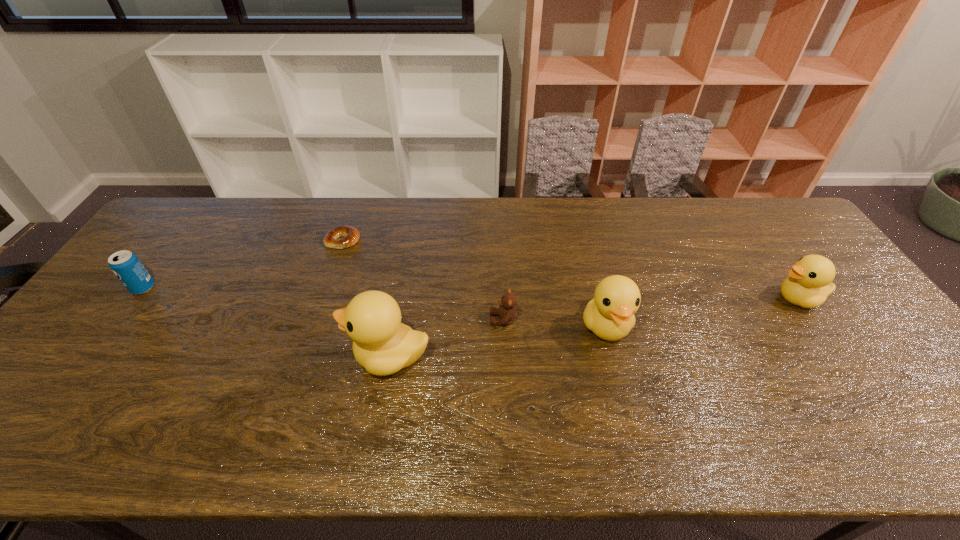
Locate an element on the screen. The image size is (960, 540). teddy bear is located at coordinates (507, 312).

Locate an element on the screen. free point located 0.370m on the face of the third object from left to right is located at coordinates (201, 356).

I want to click on free space located 0.390m on the face of the third object from left to right, so click(x=193, y=356).

The height and width of the screenshot is (540, 960). In order to click on vacant space situated on the face of the third object from left to right in this screenshot , I will do `click(217, 356)`.

This screenshot has height=540, width=960. Find the location of `blank space located 0.090m on the face of the fifth object from left to right`. blank space located 0.090m on the face of the fifth object from left to right is located at coordinates (621, 384).

Image resolution: width=960 pixels, height=540 pixels. Identify the location of vacant space situated on the face of the shortest duck. (744, 299).

Where is `vacant space located 0.310m on the face of the shortest duck`? vacant space located 0.310m on the face of the shortest duck is located at coordinates (662, 299).

In order to click on free space located 0.320m on the face of the shortest duck in this screenshot , I will do [x=660, y=299].

I want to click on free space located 0.180m on the right of the farthest object, so click(416, 240).

In order to click on vacant region located on the front of the third shortest object in this screenshot , I will do `click(53, 409)`.